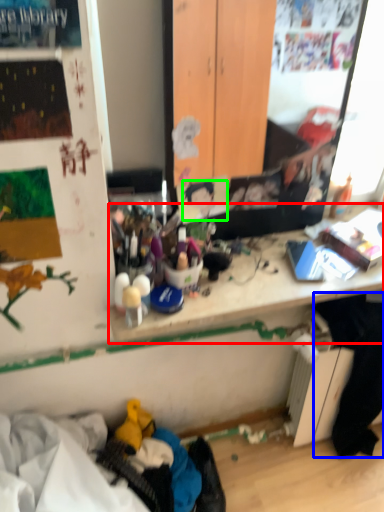
Question: Which object is positioned closest to writing desk (highlighted by a red box)? Select from clothing (highlighted by a blue box) and person (highlighted by a green box).

Choices:
 (A) clothing
 (B) person

Answer: (B)